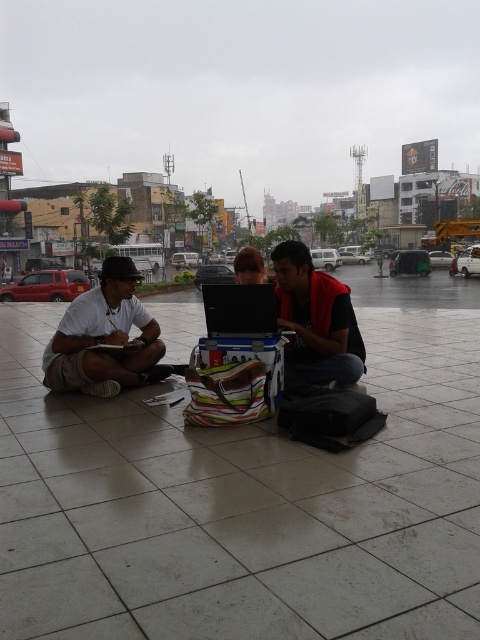
Is point (228, 609) closer to camera compared to point (291, 308)?

Yes, point (228, 609) is in front of point (291, 308).

Who is more forward, (180, 570) or (292, 273)?

Point (180, 570)

Identify the location of white tile pavement at center. (242, 504).

Is point (147, 332) positioned behind point (266, 288)?

Yes, point (147, 332) is behind point (266, 288).

Locate an element on the screen. This screenshot has width=480, height=640. matte white shirt at left is located at coordinates (104, 337).

Which is in front, point (282, 584) or point (205, 291)?

Point (282, 584)

Does white tile pavement at center have a smaller size compared to black matte laptop at center?

Yes.

Is point (84, 628) in front of point (228, 284)?

Yes, point (84, 628) is closer to viewer.

Locate an element on the screen. white tile pavement at center is located at coordinates (242, 504).